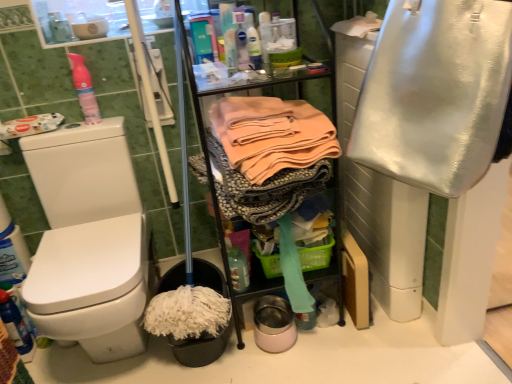
Question: From the image's perspective, is translucent plastic bottle at center under green plastic basket at center?

Choices:
 (A) no
 (B) yes

Answer: (B)

Question: Is translucent plastic bottle at center at the left side of green plastic basket at center?

Choices:
 (A) no
 (B) yes

Answer: (B)

Question: Can you confirm if translucent plastic bottle at center is taller than green plastic basket at center?

Choices:
 (A) no
 (B) yes

Answer: (B)

Question: Considering the relative sizes of translucent plastic bottle at center and green plastic basket at center in the image provided, is translucent plastic bottle at center shorter than green plastic basket at center?

Choices:
 (A) yes
 (B) no

Answer: (B)

Question: Is translucent plastic bottle at center aimed at green plastic basket at center?

Choices:
 (A) no
 (B) yes

Answer: (A)

Question: In terms of size, does translucent plastic bottle at center appear bigger or smaller than pink matte spray can at upper left?

Choices:
 (A) big
 (B) small

Answer: (B)

Question: Considering the positions of point (239, 284) and point (90, 102), is point (239, 284) closer or farther from the camera than point (90, 102)?

Choices:
 (A) farther
 (B) closer

Answer: (B)

Question: Which is correct: translucent plastic bottle at center is inside pink matte spray can at upper left, or outside of it?

Choices:
 (A) outside
 (B) inside

Answer: (A)

Question: From a real-world perspective, is translucent plastic bottle at center above or below pink matte spray can at upper left?

Choices:
 (A) below
 (B) above

Answer: (A)

Question: Visually, is shiny metallic bag at right, acting as the 2th clothing starting from the left, positioned to the left or to the right of pink matte spray can at upper left?

Choices:
 (A) left
 (B) right

Answer: (B)

Question: In the image, is shiny metallic bag at right, which is the 1th clothing from right to left, positioned in front of or behind pink matte spray can at upper left?

Choices:
 (A) behind
 (B) front

Answer: (B)

Question: Is shiny metallic bag at right, which is the 1th clothing from right to left, wider or thinner than pink matte spray can at upper left?

Choices:
 (A) thin
 (B) wide

Answer: (B)

Question: Considering the positions of shiny metallic bag at right, acting as the 2th clothing starting from the left, and pink matte spray can at upper left in the image, is shiny metallic bag at right, acting as the 2th clothing starting from the left, taller or shorter than pink matte spray can at upper left?

Choices:
 (A) short
 (B) tall

Answer: (B)

Question: In the image, is soft peach fabric at center, which ranks as the second clothing in right-to-left order, on the left side or the right side of translucent plastic bottle at center?

Choices:
 (A) left
 (B) right

Answer: (B)

Question: Considering the positions of soft peach fabric at center, the first clothing viewed from the left, and translucent plastic bottle at center in the image, is soft peach fabric at center, the first clothing viewed from the left, bigger or smaller than translucent plastic bottle at center?

Choices:
 (A) small
 (B) big

Answer: (B)